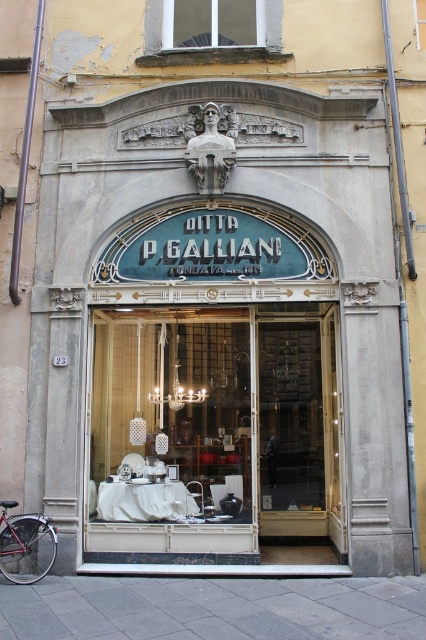
Question: Which of these objects is positioned farthest from the matte glass door at center?

Choices:
 (A) gold/glass door at center
 (B) white glass window at upper center
 (C) shiny red bicycle at lower left

Answer: (B)

Question: Which object is farther from the camera taking this photo?

Choices:
 (A) shiny red bicycle at lower left
 (B) matte glass door at center
 (C) white glass window at upper center
 (D) gold/glass door at center

Answer: (C)

Question: Can you confirm if matte glass door at center is bigger than gold/glass door at center?

Choices:
 (A) yes
 (B) no

Answer: (A)

Question: Is white glass window at upper center in front of shiny red bicycle at lower left?

Choices:
 (A) no
 (B) yes

Answer: (A)

Question: Can you confirm if gold/glass door at center is smaller than white glass window at upper center?

Choices:
 (A) no
 (B) yes

Answer: (A)

Question: Among these points, which one is farthest from the camera?

Choices:
 (A) (230, 28)
 (B) (22, 541)

Answer: (A)